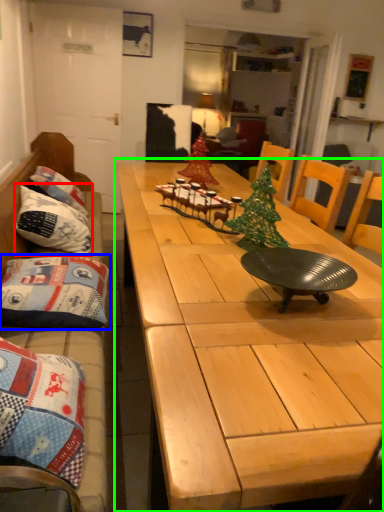
Question: Based on their relative distances, which object is farther from pillow (highlighted by a red box)? Choose from pillow (highlighted by a blue box) and table (highlighted by a green box).

Choices:
 (A) pillow
 (B) table

Answer: (B)